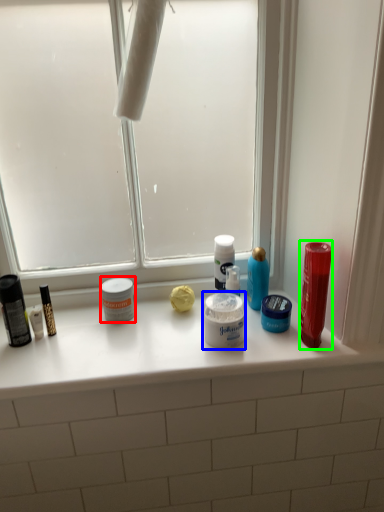
Question: Which is nearer to the toiletry (highlighted by a red box)? cream (highlighted by a blue box) or mouthwash (highlighted by a green box).

Choices:
 (A) cream
 (B) mouthwash

Answer: (A)